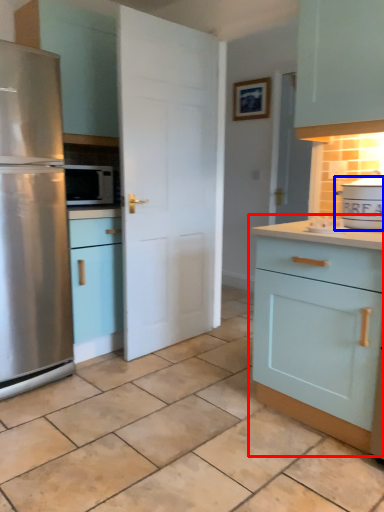
Question: Which of the following is the farthest to the observer, cabinetry (highlighted by a red box) or appliance (highlighted by a blue box)?

Choices:
 (A) cabinetry
 (B) appliance

Answer: (B)